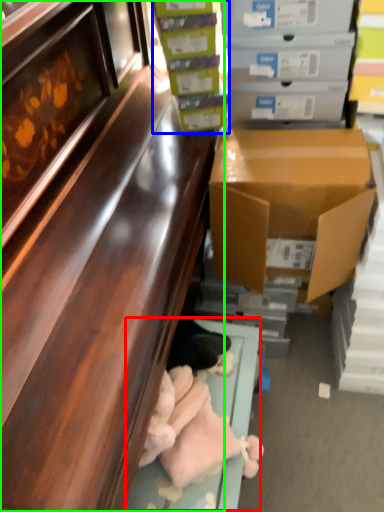
Question: Considering the real-world distances, which object is closest to window sill (highlighted by a red box)? box (highlighted by a blue box) or cabinetry (highlighted by a green box).

Choices:
 (A) box
 (B) cabinetry

Answer: (B)